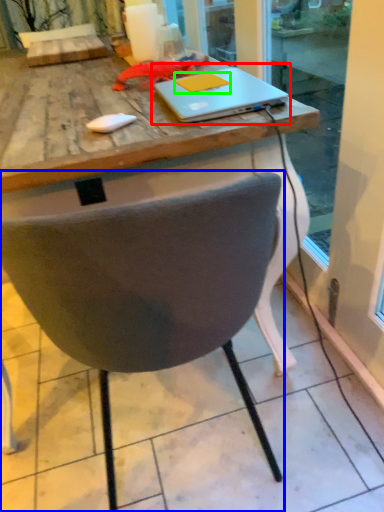
Question: Which is nearer to the laptop (highlighted by a red box)? chair (highlighted by a blue box) or notepad (highlighted by a green box).

Choices:
 (A) chair
 (B) notepad

Answer: (B)